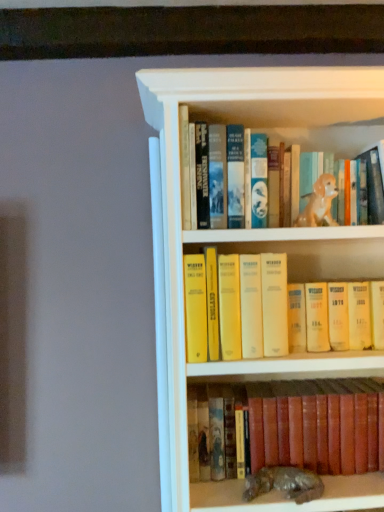
Question: Which direction should I rotate to look at golden ceramic dog at upper center, which is the 2th animal in bottom-to-top order, — up or down?

Choices:
 (A) up
 (B) down

Answer: (A)

Question: From a real-world perspective, is leather-bound book at lower center, which is the 1th book in bottom-to-top order, positioned under golden ceramic dog at upper center, which is the 2th animal in bottom-to-top order, based on gravity?

Choices:
 (A) no
 (B) yes

Answer: (B)

Question: Is leather-bound book at lower center, which ranks as the second book in top-to-bottom order, positioned in front of golden ceramic dog at upper center, acting as the 1th animal starting from the top?

Choices:
 (A) yes
 (B) no

Answer: (B)

Question: Can you confirm if leather-bound book at lower center, which ranks as the second book in top-to-bottom order, is wider than golden ceramic dog at upper center, which is the 2th animal in bottom-to-top order?

Choices:
 (A) no
 (B) yes

Answer: (B)

Question: Is leather-bound book at lower center, which ranks as the second book in top-to-bottom order, far away from golden ceramic dog at upper center, acting as the 1th animal starting from the top?

Choices:
 (A) yes
 (B) no

Answer: (B)

Question: Would you say leather-bound book at lower center, which is the 1th book in bottom-to-top order, contains golden ceramic dog at upper center, which is the 2th animal in bottom-to-top order?

Choices:
 (A) yes
 (B) no

Answer: (B)

Question: Considering the relative sizes of leather-bound book at lower center, which is the 1th book in bottom-to-top order, and golden ceramic dog at upper center, acting as the 1th animal starting from the top, in the image provided, is leather-bound book at lower center, which is the 1th book in bottom-to-top order, shorter than golden ceramic dog at upper center, acting as the 1th animal starting from the top,?

Choices:
 (A) no
 (B) yes

Answer: (A)

Question: Does golden ceramic dog at upper center, which is the 2th animal in bottom-to-top order, come in front of leather-bound book at lower center, which is the 1th book in bottom-to-top order?

Choices:
 (A) yes
 (B) no

Answer: (A)

Question: Considering the relative sizes of golden ceramic dog at upper center, which is the 2th animal in bottom-to-top order, and leather-bound book at lower center, which is the 1th book in bottom-to-top order, in the image provided, is golden ceramic dog at upper center, which is the 2th animal in bottom-to-top order, bigger than leather-bound book at lower center, which is the 1th book in bottom-to-top order,?

Choices:
 (A) yes
 (B) no

Answer: (B)

Question: Does golden ceramic dog at upper center, acting as the 1th animal starting from the top, have a smaller size compared to leather-bound book at lower center, which is the 1th book in bottom-to-top order?

Choices:
 (A) yes
 (B) no

Answer: (A)

Question: From a real-world perspective, is golden ceramic dog at upper center, which is the 2th animal in bottom-to-top order, under leather-bound book at lower center, which is the 1th book in bottom-to-top order?

Choices:
 (A) yes
 (B) no

Answer: (B)

Question: Is golden ceramic dog at upper center, which is the 2th animal in bottom-to-top order, at the left side of leather-bound book at lower center, which ranks as the second book in top-to-bottom order?

Choices:
 (A) yes
 (B) no

Answer: (B)

Question: From a real-world perspective, is golden ceramic dog at upper center, which is the 2th animal in bottom-to-top order, physically above leather-bound book at lower center, which ranks as the second book in top-to-bottom order?

Choices:
 (A) no
 (B) yes

Answer: (B)

Question: Does shiny metallic statue at lower center, which is the second animal in top-to-bottom order, have a lesser width compared to yellow paperbacks at center, acting as the first book starting from the top?

Choices:
 (A) yes
 (B) no

Answer: (A)